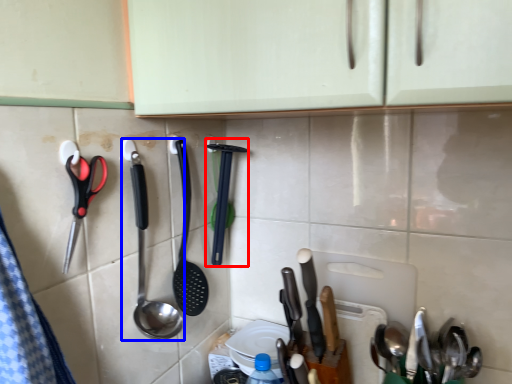
Question: Which object is closer to the camera taking this photo, spatula (highlighted by a red box) or spoon (highlighted by a blue box)?

Choices:
 (A) spatula
 (B) spoon

Answer: (B)